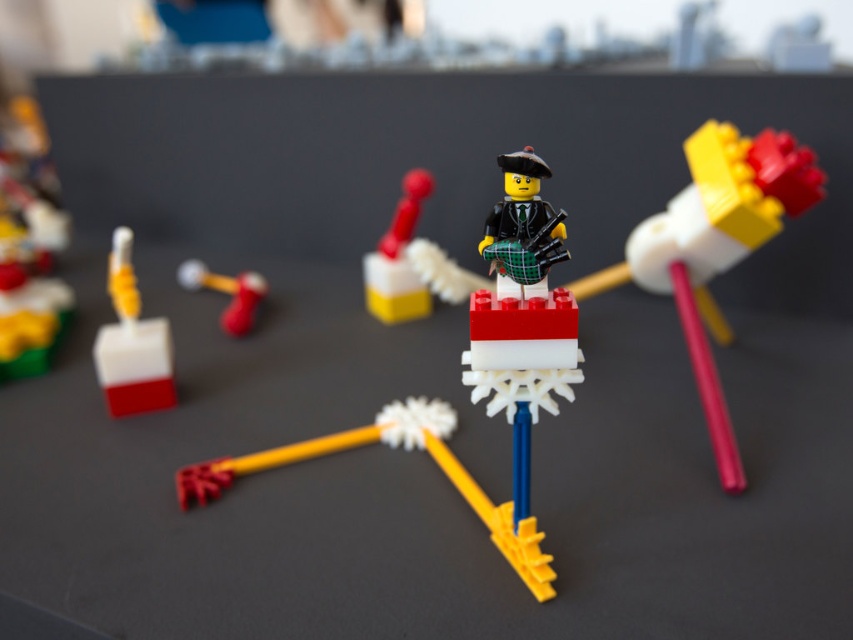
Who is more distant from viewer, (165,324) or (402,237)?

Positioned behind is point (402,237).

Where is `white matte block at left`? white matte block at left is located at coordinates (132, 342).

Based on the photo, is brick-like white and red object at center shorter than matte yellow pencil at center?

Incorrect, brick-like white and red object at center's height does not fall short of matte yellow pencil at center's.

Between point (712, 225) and point (223, 326), which one is positioned in front?

Positioned in front is point (712, 225).

Between point (723, 262) and point (260, 298), which one is positioned behind?

Positioned behind is point (260, 298).

This screenshot has width=853, height=640. I want to click on brick-like white and red object at center, so click(715, 246).

Does smooth white block at center have a smaller size compared to matte yellow pencil at center?

Yes, smooth white block at center is smaller than matte yellow pencil at center.

Is point (415, 198) behind point (192, 268)?

No, (415, 198) is closer to viewer.

Locate an element on the screen. This screenshot has height=640, width=853. smooth white block at center is located at coordinates (398, 259).